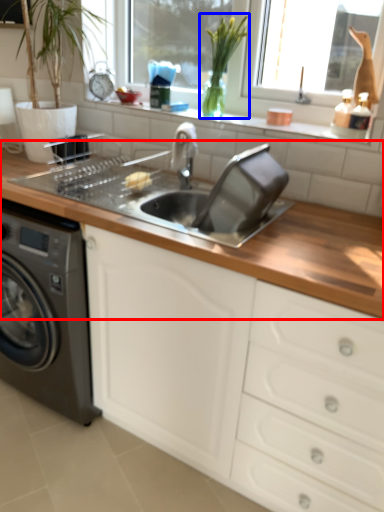
Question: Which point is further to the camera, countertop (highlighted by a red box) or plant (highlighted by a blue box)?

Choices:
 (A) countertop
 (B) plant

Answer: (B)